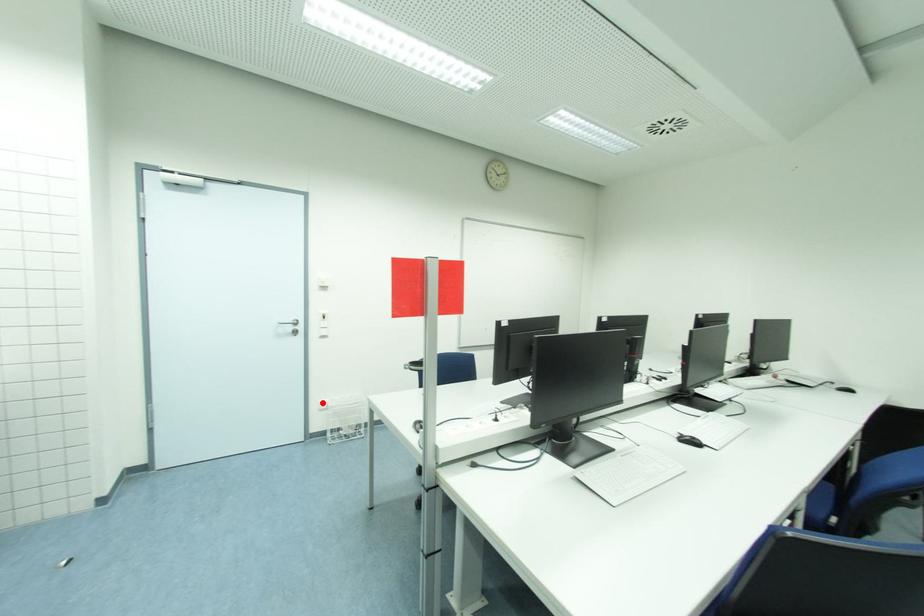
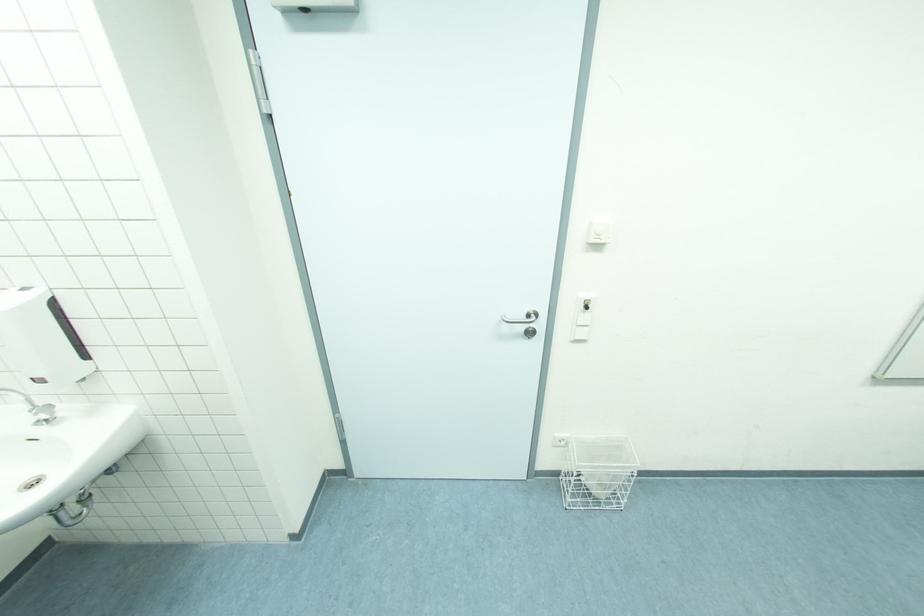
The point at the highlighted location is marked in the first image. Where is the corresponding point in the second image?

(560, 437)